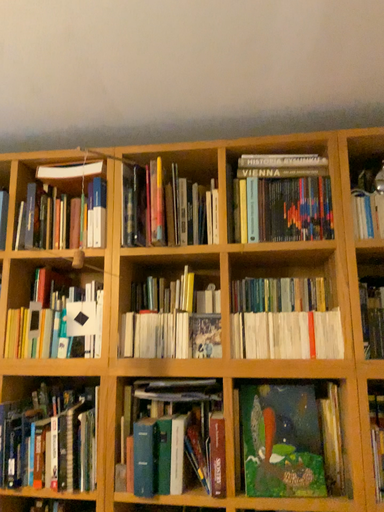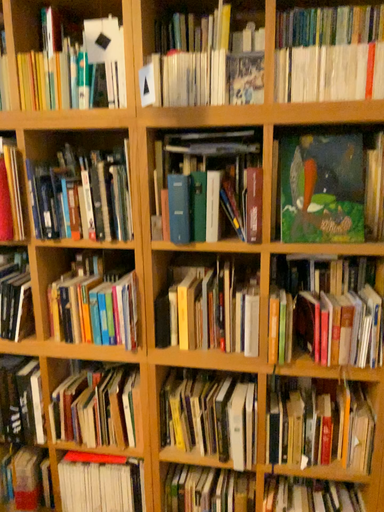
Question: How did the camera likely rotate when shooting the video?

Choices:
 (A) rotated upward
 (B) rotated downward

Answer: (B)